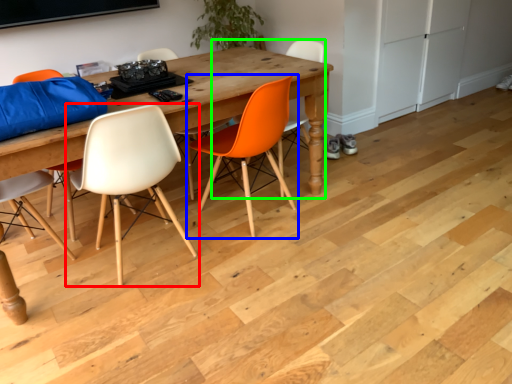
Question: Estimate the real-world distances between objects in this image. Which object is farther from chair (highlighted by a red box), chair (highlighted by a blue box) or chair (highlighted by a green box)?

Choices:
 (A) chair
 (B) chair

Answer: (B)